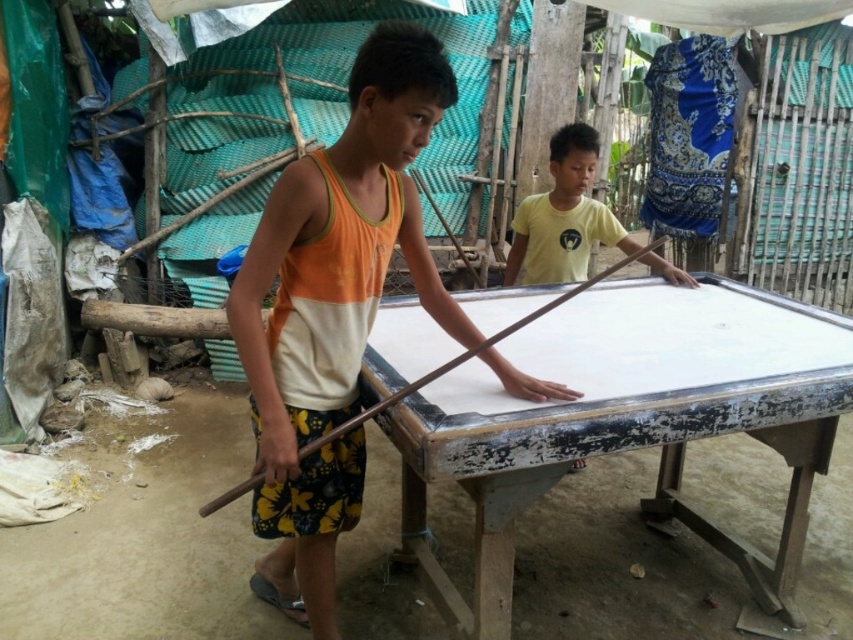
Can you confirm if white painted wood billiard table at center is wider than brown wooden stick at center?

Indeed, white painted wood billiard table at center has a greater width compared to brown wooden stick at center.

Is white painted wood billiard table at center behind brown wooden stick at center?

Yes.

Between point (407, 323) and point (306, 454), which one is positioned in front?

Point (306, 454) is more forward.

Where is `white painted wood billiard table at center`? Image resolution: width=853 pixels, height=640 pixels. white painted wood billiard table at center is located at coordinates (625, 422).

Which is above, orange and white tank top at center or brown wooden stick at center?

Positioned higher is brown wooden stick at center.

Between orange and white tank top at center and brown wooden stick at center, which one appears on the left side from the viewer's perspective?

orange and white tank top at center

Which is in front, point (538, 387) or point (315, 444)?

Positioned in front is point (315, 444).

This screenshot has width=853, height=640. Find the location of `orange and white tank top at center`. orange and white tank top at center is located at coordinates (334, 310).

Does white painted wood billiard table at center have a greater width compared to orange and white tank top at center?

Yes.

Which is more to the left, white painted wood billiard table at center or orange and white tank top at center?

orange and white tank top at center is more to the left.

Is point (677, 508) closer to viewer compared to point (344, 324)?

No, (677, 508) is behind (344, 324).

Locate an element on the screen. white painted wood billiard table at center is located at coordinates tap(625, 422).